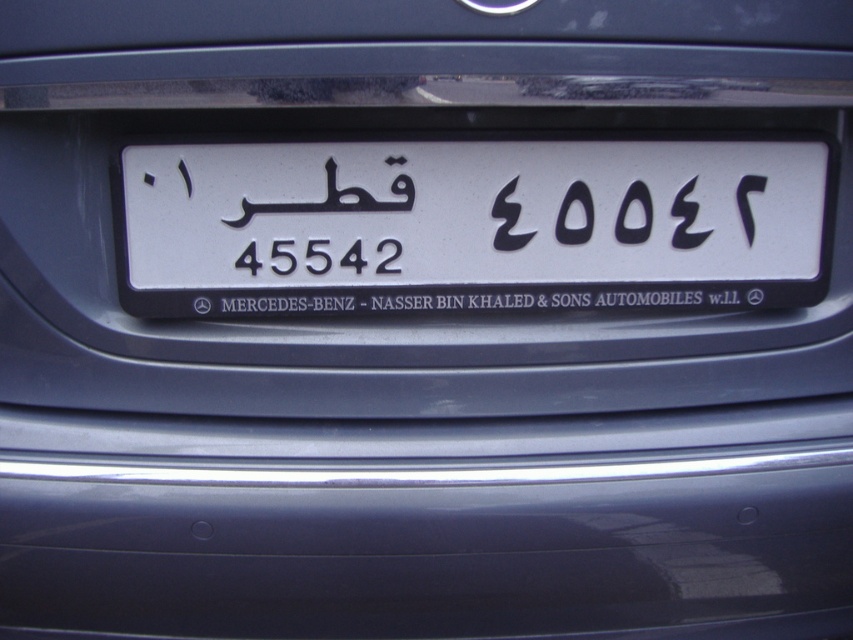
You are a traffic officer checking the license plate of a car. You notice the white plastic license plate at center and the black matte number at upper right. Which object is closer to you?

The white plastic license plate at center is closer to you because it is in front of the black matte number at upper right.

You are a traffic officer checking the license plate of a car. The system shows that the license plate should be located at coordinates point 0.355, 0.550. Where should you look on the car to find the white plastic license plate at center?

You should look at point (468,227) on the car to find the white plastic license plate at center as it is located there.